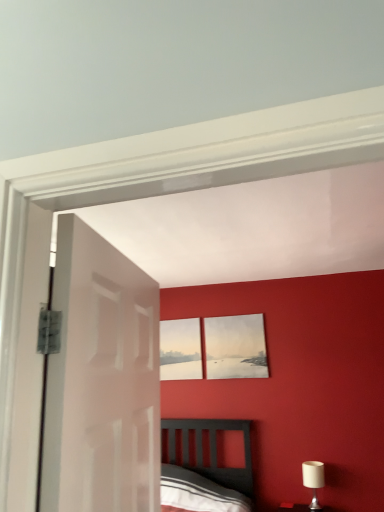
Question: Is white glossy door at left positioned with its back to white fabric-covered lampshade at lower right?

Choices:
 (A) no
 (B) yes

Answer: (A)

Question: Is white glossy door at left oriented towards white fabric-covered lampshade at lower right?

Choices:
 (A) yes
 (B) no

Answer: (B)

Question: Does white glossy door at left appear on the left side of white fabric-covered lampshade at lower right?

Choices:
 (A) yes
 (B) no

Answer: (A)

Question: Is white glossy door at left located outside white fabric-covered lampshade at lower right?

Choices:
 (A) yes
 (B) no

Answer: (A)

Question: Would you say white fabric-covered lampshade at lower right is part of white glossy door at left's contents?

Choices:
 (A) yes
 (B) no

Answer: (B)

Question: Considering their positions, is matte gray picture frame at upper center, the second picture frame positioned from the left, located in front of or behind matte white picture frame at center, the 1th picture frame positioned from the left?

Choices:
 (A) front
 (B) behind

Answer: (A)

Question: From a real-world perspective, is matte gray picture frame at upper center, the first picture frame positioned from the right, physically located above or below matte white picture frame at center, the second picture frame positioned from the right?

Choices:
 (A) above
 (B) below

Answer: (B)

Question: Is matte gray picture frame at upper center, the first picture frame positioned from the right, wider or thinner than matte white picture frame at center, the 1th picture frame positioned from the left?

Choices:
 (A) wide
 (B) thin

Answer: (B)

Question: Considering the relative positions of matte gray picture frame at upper center, the second picture frame positioned from the left, and matte white picture frame at center, the 1th picture frame positioned from the left, in the image provided, is matte gray picture frame at upper center, the second picture frame positioned from the left, to the left or to the right of matte white picture frame at center, the 1th picture frame positioned from the left,?

Choices:
 (A) left
 (B) right

Answer: (B)

Question: Is matte gray picture frame at upper center, the first picture frame positioned from the right, inside the boundaries of white fabric-covered lampshade at lower right, or outside?

Choices:
 (A) outside
 (B) inside

Answer: (A)

Question: From the image's perspective, relative to white fabric-covered lampshade at lower right, is matte gray picture frame at upper center, the first picture frame positioned from the right, above or below?

Choices:
 (A) below
 (B) above

Answer: (B)

Question: From a real-world perspective, is matte gray picture frame at upper center, the first picture frame positioned from the right, above or below white fabric-covered lampshade at lower right?

Choices:
 (A) above
 (B) below

Answer: (A)

Question: Is matte gray picture frame at upper center, the second picture frame positioned from the left, to the left or to the right of white fabric-covered lampshade at lower right in the image?

Choices:
 (A) left
 (B) right

Answer: (A)

Question: Considering the relative positions of matte gray picture frame at upper center, the first picture frame positioned from the right, and white glossy door at left in the image provided, is matte gray picture frame at upper center, the first picture frame positioned from the right, to the left or to the right of white glossy door at left?

Choices:
 (A) right
 (B) left

Answer: (A)

Question: Would you say matte gray picture frame at upper center, the first picture frame positioned from the right, is inside or outside white glossy door at left?

Choices:
 (A) outside
 (B) inside

Answer: (A)